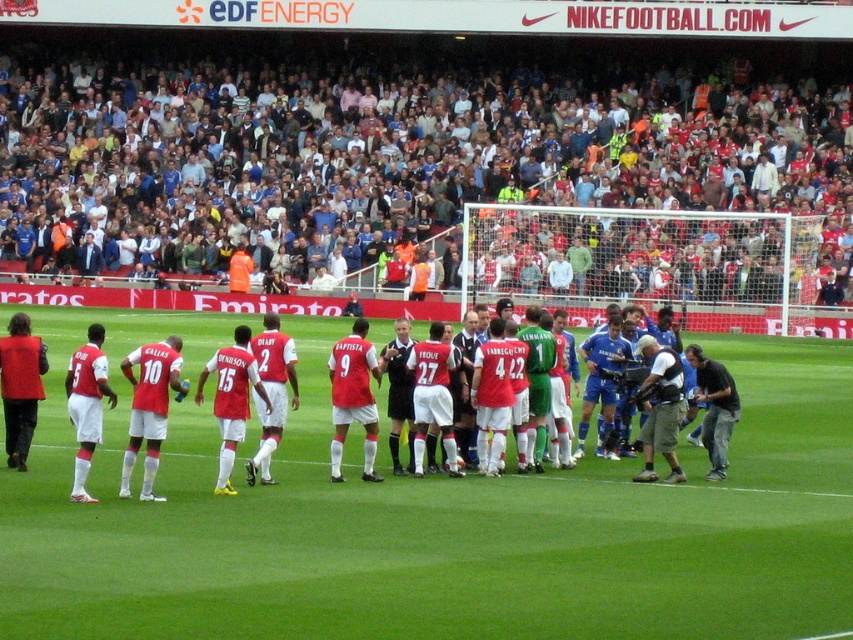
You are a photographer standing at the point marked as point (x=28, y=504) in the stadium. You want to take a photo of the referee who is 47.78 feet away from you. Is the referee within your camera range if your camera can capture up to 50 feet?

The referee is 47.78 feet away from the photographer at point (x=28, y=504), which is within the camera range of 50 feet. Therefore, the referee can be captured in the photo.

What are the coordinates of the green grass field at center?

The coordinates of the green grass field at center are at point (432, 520).

Consider the image. You are a photographer standing at the edge of the field. You want to take a photo that includes both the white fabric crowd at upper center and the white matte soccer team at center. Considering their distance apart, will you need to zoom in or zoom out to capture both in the same frame?

The white fabric crowd at upper center is 8.75 meters away from the white matte soccer team at center. To capture both in the same frame, you would need to zoom out to include the distance between them.